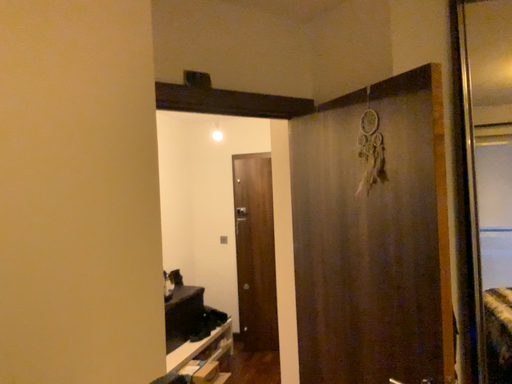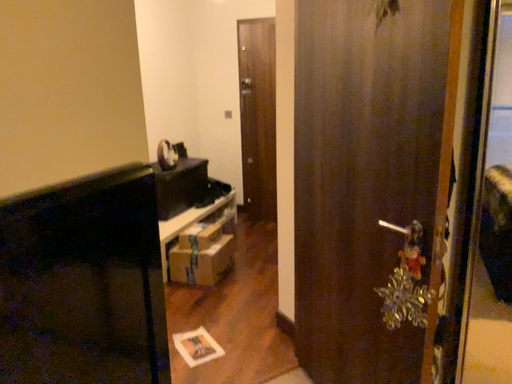
Question: How did the camera likely rotate when shooting the video?

Choices:
 (A) rotated upward
 (B) rotated downward

Answer: (B)